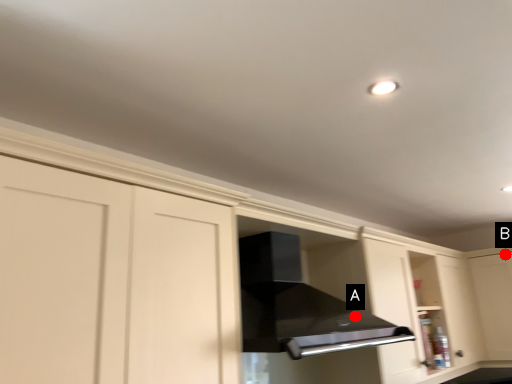
Question: Two points are circled on the image, labeled by A and B beside each circle. Which point is farther from the camera taking this photo?

Choices:
 (A) A is further
 (B) B is further

Answer: (B)